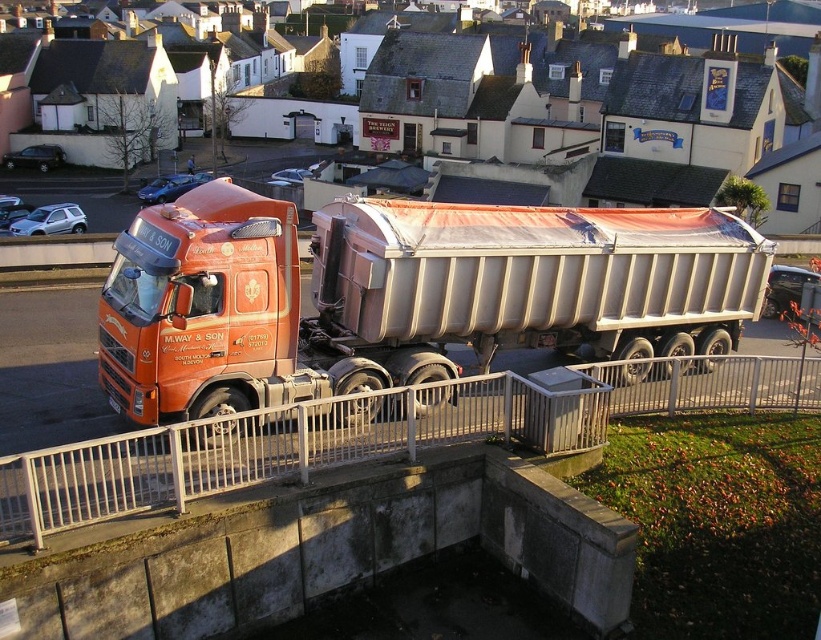
Question: Among these points, which one is farthest from the camera?

Choices:
 (A) (219, 243)
 (B) (521, 388)

Answer: (B)

Question: Which of the following is the closest to the observer?

Choices:
 (A) metallic silver railing at lower center
 (B) matte orange trailer truck at center

Answer: (A)

Question: Is matte orange trailer truck at center further to camera compared to metallic silver railing at lower center?

Choices:
 (A) yes
 (B) no

Answer: (A)

Question: Does matte orange trailer truck at center have a larger size compared to metallic silver railing at lower center?

Choices:
 (A) yes
 (B) no

Answer: (A)

Question: Does matte orange trailer truck at center appear under metallic silver railing at lower center?

Choices:
 (A) no
 (B) yes

Answer: (A)